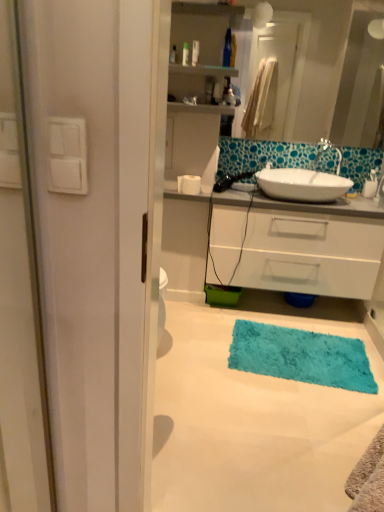
At what (x,y) coordinates should I click in order to perform the action: click on free space above turquoise shaggy bath mat at lower center (from a real-world perspective). Please return your answer as a coordinate pair (x, y). Looking at the image, I should click on (298, 349).